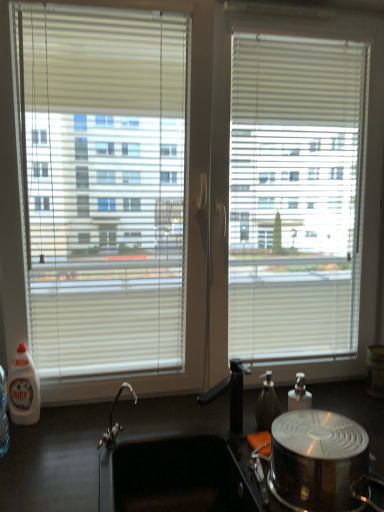
Question: From the image's perspective, is black matte countertop at lower center above or below white plastic bottle at left, placed as the first bottle when sorted from left to right?

Choices:
 (A) above
 (B) below

Answer: (B)

Question: From a real-world perspective, is black matte countertop at lower center physically located above or below white plastic bottle at left, which appears as the second bottle when viewed from the right?

Choices:
 (A) above
 (B) below

Answer: (B)

Question: Based on their relative distances, which object is farther from the transparent plastic soap dispenser at center-right, which is the first bottle from right to left?

Choices:
 (A) shiny metallic pot at lower right
 (B) white plastic bottle at left, placed as the first bottle when sorted from left to right
 (C) black matte countertop at lower center

Answer: (B)

Question: Considering the real-world distances, which object is closest to the transparent plastic soap dispenser at center-right, which is the first bottle from right to left?

Choices:
 (A) shiny metallic pot at lower right
 (B) black matte countertop at lower center
 (C) white plastic bottle at left, which appears as the second bottle when viewed from the right

Answer: (A)